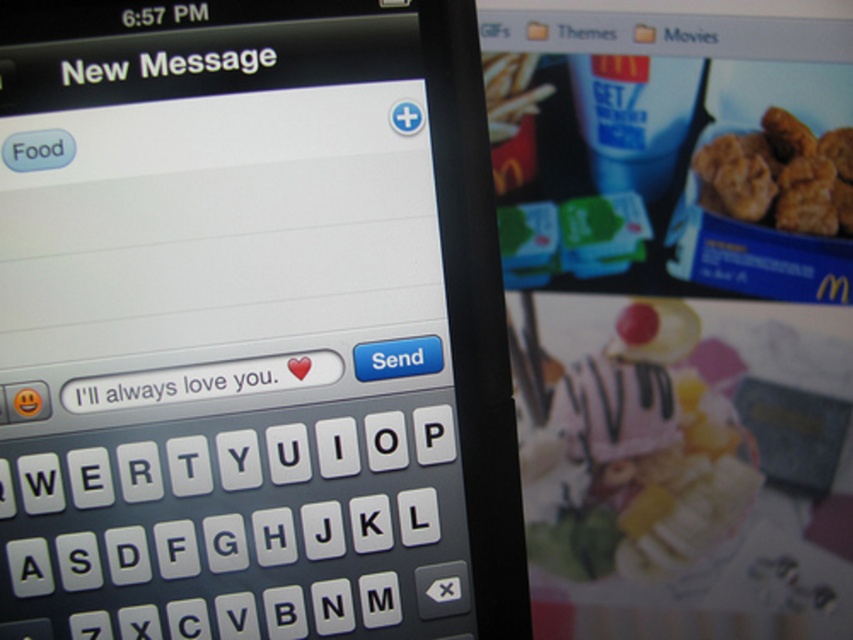
Question: Estimate the real-world distances between objects in this image. Which object is closer to the white plastic keyboard at center?

Choices:
 (A) white matte text message at center
 (B) black plastic smartphone at center

Answer: (B)

Question: Is black plastic smartphone at center positioned in front of white matte text message at center?

Choices:
 (A) yes
 (B) no

Answer: (A)

Question: Is black plastic smartphone at center thinner than golden crispy nuggets at upper right?

Choices:
 (A) yes
 (B) no

Answer: (B)

Question: Is white plastic keyboard at center below golden crispy nuggets at upper right?

Choices:
 (A) no
 (B) yes

Answer: (B)

Question: Which object appears farthest from the camera in this image?

Choices:
 (A) golden crispy nuggets at upper right
 (B) white matte text message at center

Answer: (A)

Question: Which object is positioned farthest from the white matte text message at center?

Choices:
 (A) white plastic keyboard at center
 (B) golden crispy nuggets at upper right

Answer: (B)